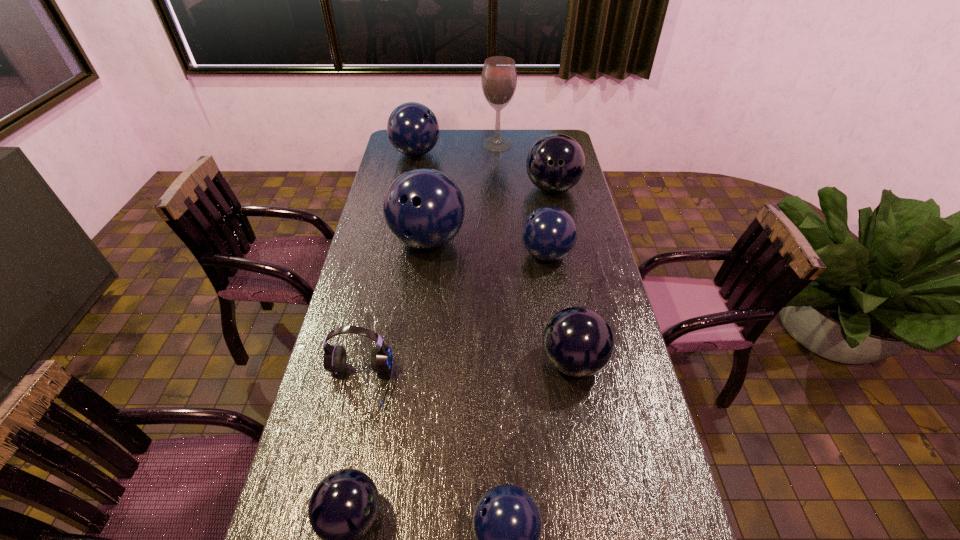
Locate an element on the screen. black bowling ball that is the third nearest to the smallest blue bowling ball is located at coordinates (555, 163).

Locate an element on the screen. The width and height of the screenshot is (960, 540). black bowling ball that is the closest one to the biggest blue bowling ball is located at coordinates (555, 163).

Where is `vacant space that satisfies the following two spatial constraints: 1. on the side of the third farthest object with the finger holes; 2. on the side of the second smallest black bowling ball with the finger holes`? vacant space that satisfies the following two spatial constraints: 1. on the side of the third farthest object with the finger holes; 2. on the side of the second smallest black bowling ball with the finger holes is located at coordinates (588, 362).

The height and width of the screenshot is (540, 960). I want to click on free spot that satisfies the following two spatial constraints: 1. on the side of the farthest black bowling ball with the finger holes; 2. on the surface of the rightmost blue bowling ball near the finger holes, so click(x=565, y=254).